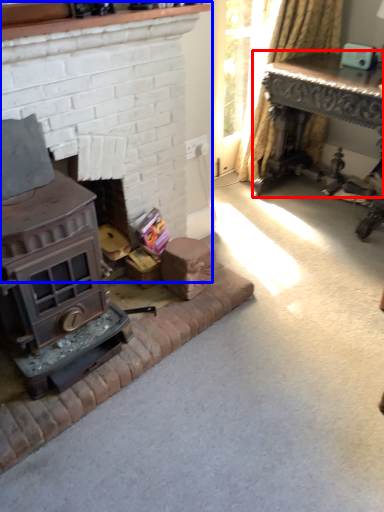
Question: Which object appears farthest to the camera in this image, table (highlighted by a red box) or fireplace (highlighted by a blue box)?

Choices:
 (A) table
 (B) fireplace

Answer: (A)